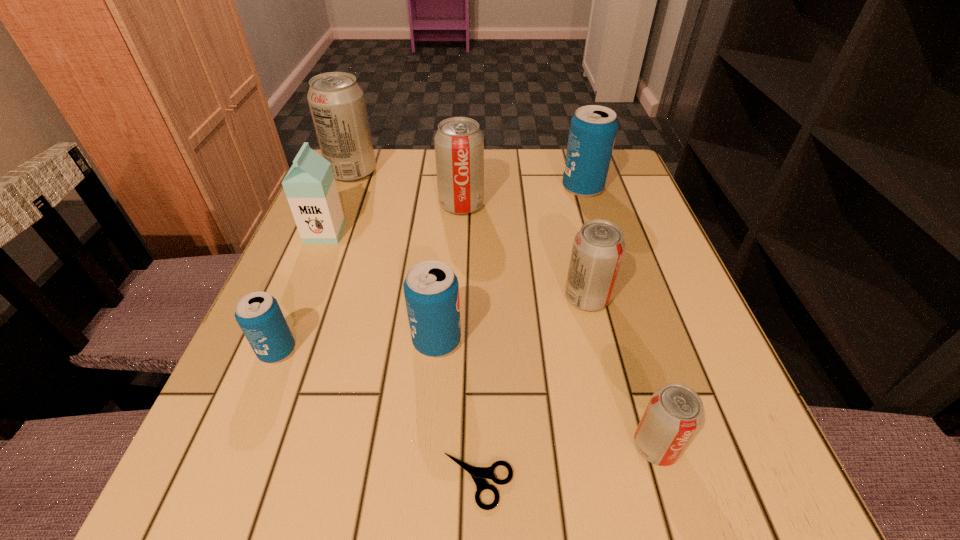
This screenshot has width=960, height=540. In the image, there is a desktop. In order to click on vacant space at the far edge in this screenshot , I will do [x=427, y=195].

Find the location of a particular element. vacant space at the near edge is located at coordinates (402, 480).

Image resolution: width=960 pixels, height=540 pixels. In order to click on free point at the left edge in this screenshot , I will do `click(313, 334)`.

Identify the location of free region at the right edge of the desktop. (631, 208).

You are a GUI agent. You are given a task and a screenshot of the screen. Output one action in this format:
    pyautogui.click(x=<x>, y=<y>)
    Task: Click on the vacant space at the far left corner
    
    Given the screenshot: What is the action you would take?
    pyautogui.click(x=379, y=184)

Where is `vacant position at the far right corner of the desktop`? The image size is (960, 540). vacant position at the far right corner of the desktop is located at coordinates (610, 174).

You are a GUI agent. You are given a task and a screenshot of the screen. Output one action in this format:
    pyautogui.click(x=<x>, y=<y>)
    Task: Click on the blank region between the white milk carton and the leftmost blue soda can
    The width and height of the screenshot is (960, 540).
    Given the screenshot: What is the action you would take?
    pyautogui.click(x=301, y=292)

Identify the location of unoccupied position between the nearest soda can and the second biggest gray soda can. This screenshot has height=540, width=960. (559, 326).

The height and width of the screenshot is (540, 960). In order to click on vacant space in between the third biggest gray soda can and the second gray soda can from left to right in this screenshot , I will do `click(524, 252)`.

At what (x,y) coordinates should I click in order to perform the action: click on free space between the leftmost blue soda can and the second smallest blue soda can. Please return your answer as a coordinate pair (x, y). This screenshot has width=960, height=540. Looking at the image, I should click on (357, 346).